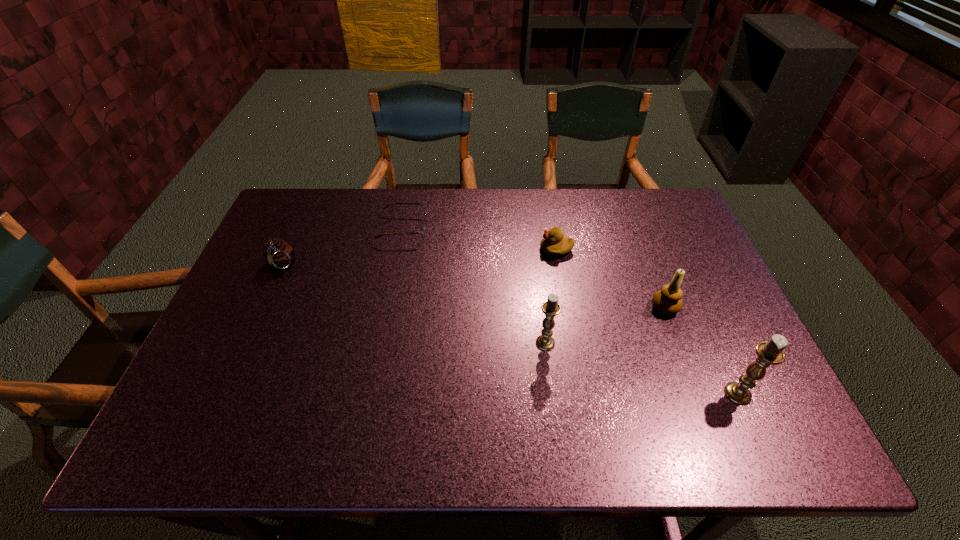
Find the location of a particular element. vacant space in between the second tallest candle_holder and the fifth object from left to right is located at coordinates (605, 325).

Where is `free space between the fifth shortest object and the tallest candle_holder`? The height and width of the screenshot is (540, 960). free space between the fifth shortest object and the tallest candle_holder is located at coordinates (641, 368).

The width and height of the screenshot is (960, 540). In order to click on free space that is in between the spectacles and the leftmost object in this screenshot , I will do `click(342, 247)`.

I want to click on empty space between the farthest candle_holder and the spectacles, so click(534, 268).

This screenshot has width=960, height=540. What are the coordinates of `vacant area that lies between the spectacles and the leftmost candle_holder` in the screenshot? It's located at (474, 286).

Locate an element on the screen. The height and width of the screenshot is (540, 960). free area in between the spectacles and the leftmost object is located at coordinates (342, 247).

Where is `free space between the nearest candle_holder and the second object from left to right`? The height and width of the screenshot is (540, 960). free space between the nearest candle_holder and the second object from left to right is located at coordinates (570, 311).

Where is `free space between the second candle_holder from right to left and the duckling`? The width and height of the screenshot is (960, 540). free space between the second candle_holder from right to left and the duckling is located at coordinates (611, 278).

Identify which object is the fourth closest to the shortest object. Please provide its 2D coordinates. Your answer should be formatted as a tuple, i.e. [(x, y)], where the tuple contains the x and y coordinates of a point satisfying the conditions above.

[(668, 301)]

Where is `the fourth closest object to the leftmost candle_holder`? the fourth closest object to the leftmost candle_holder is located at coordinates (423, 228).